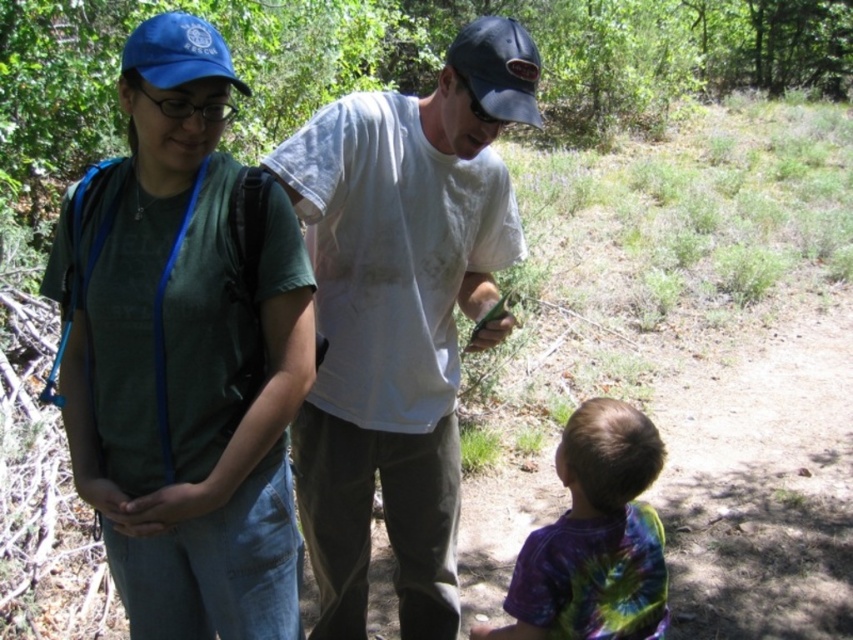
Question: Where is green matte t-shirt at center located in relation to tie-dye fabric shirt at lower right in the image?

Choices:
 (A) below
 (B) above

Answer: (B)

Question: Which point appears closest to the camera in this image?

Choices:
 (A) (529, 90)
 (B) (430, 618)

Answer: (A)

Question: Does white cotton shirt at center appear on the left side of blue fabric baseball cap at upper left?

Choices:
 (A) yes
 (B) no

Answer: (B)

Question: Which point is closer to the camera taking this photo?

Choices:
 (A) (42, 397)
 (B) (514, 76)
 (C) (511, 632)

Answer: (A)

Question: Considering the real-world distances, which object is closest to the black matte baseball cap at upper center?

Choices:
 (A) blue fabric baseball cap at upper left
 (B) white cotton shirt at center
 (C) tie-dye fabric shirt at lower right

Answer: (A)

Question: In this image, where is green matte t-shirt at center located relative to tie-dye fabric shirt at lower right?

Choices:
 (A) above
 (B) below

Answer: (A)